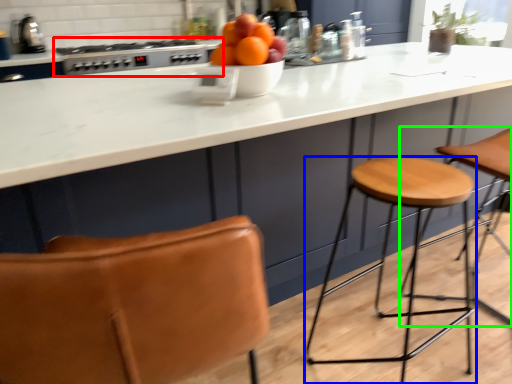
Question: Which object is the closest to the gas stove (highlighted by a red box)? Choose among these: stool (highlighted by a blue box) or step stool (highlighted by a green box).

Choices:
 (A) stool
 (B) step stool

Answer: (A)